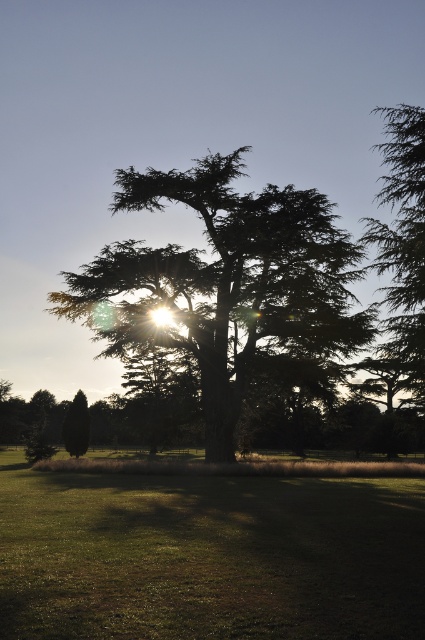
Question: Does green grassy field at center appear under green textured tree at center?

Choices:
 (A) yes
 (B) no

Answer: (A)

Question: Estimate the real-world distances between objects in this image. Which object is farther from the green matte tree at lower left?

Choices:
 (A) green needle-like tree at right
 (B) green grassy field at center
 (C) green textured tree at center

Answer: (A)

Question: From the image, what is the correct spatial relationship of green grassy field at center in relation to green needle-like tree at right?

Choices:
 (A) right
 (B) left

Answer: (B)

Question: Which of the following is the closest to the observer?

Choices:
 (A) green textured tree at center
 (B) green grassy field at center

Answer: (B)

Question: Which of the following is the closest to the observer?

Choices:
 (A) green textured tree at center
 (B) green matte tree at lower left
 (C) green needle-like tree at right
 (D) green grassy field at center

Answer: (D)

Question: Is the position of green grassy field at center less distant than that of green matte tree at lower left?

Choices:
 (A) no
 (B) yes

Answer: (B)